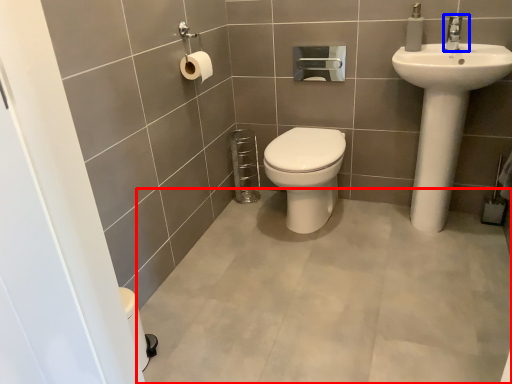
Question: Which object is closer to the camera taking this photo, plain (highlighted by a red box) or tap (highlighted by a blue box)?

Choices:
 (A) plain
 (B) tap

Answer: (A)